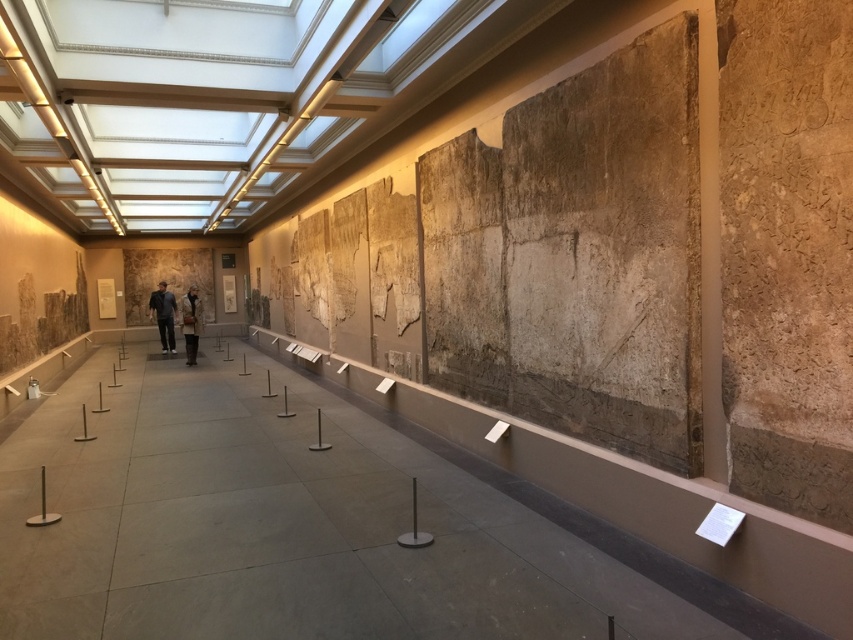
Question: Which point is closer to the camera taking this photo?

Choices:
 (A) (189, 301)
 (B) (164, 285)

Answer: (A)

Question: Does dark gray fabric jacket at center appear on the left side of brown wool coat at center?

Choices:
 (A) yes
 (B) no

Answer: (A)

Question: Which of the following is the closest to the observer?

Choices:
 (A) brown wool coat at center
 (B) dark gray fabric jacket at center

Answer: (A)

Question: Which object appears farthest from the camera in this image?

Choices:
 (A) brown wool coat at center
 (B) dark gray fabric jacket at center

Answer: (B)

Question: Does dark gray fabric jacket at center appear on the right side of brown wool coat at center?

Choices:
 (A) yes
 (B) no

Answer: (B)

Question: Observing the image, what is the correct spatial positioning of dark gray fabric jacket at center in reference to brown wool coat at center?

Choices:
 (A) above
 (B) below

Answer: (B)